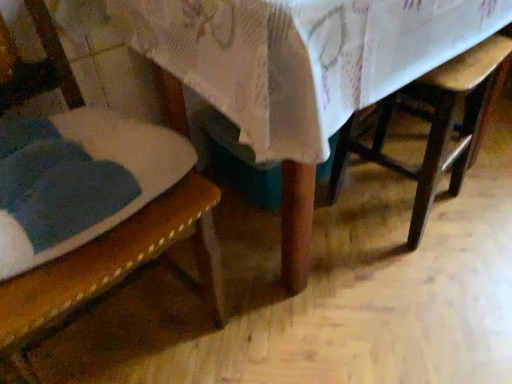
Question: Does wooden chair at lower right have a larger size compared to wooden table at center?

Choices:
 (A) yes
 (B) no

Answer: (B)

Question: Is wooden chair at lower right taller than wooden table at center?

Choices:
 (A) no
 (B) yes

Answer: (A)

Question: Is wooden chair at lower right far from wooden table at center?

Choices:
 (A) yes
 (B) no

Answer: (B)

Question: Can we say wooden chair at lower right lies outside wooden table at center?

Choices:
 (A) no
 (B) yes

Answer: (A)

Question: Is wooden chair at lower right thinner than wooden table at center?

Choices:
 (A) no
 (B) yes

Answer: (B)

Question: Considering the positions of wooden textured chair at left and wooden chair at lower right in the image, is wooden textured chair at left bigger or smaller than wooden chair at lower right?

Choices:
 (A) big
 (B) small

Answer: (A)

Question: Does point (89, 271) appear closer or farther from the camera than point (420, 173)?

Choices:
 (A) farther
 (B) closer

Answer: (B)

Question: Looking at their shapes, would you say wooden textured chair at left is wider or thinner than wooden chair at lower right?

Choices:
 (A) thin
 (B) wide

Answer: (B)

Question: In the image, is wooden textured chair at left positioned in front of or behind wooden chair at lower right?

Choices:
 (A) behind
 (B) front

Answer: (B)

Question: Looking at the image, does wooden textured chair at left seem bigger or smaller compared to wooden table at center?

Choices:
 (A) small
 (B) big

Answer: (A)

Question: Is wooden textured chair at left to the left or to the right of wooden table at center in the image?

Choices:
 (A) right
 (B) left

Answer: (B)

Question: From a real-world perspective, is wooden textured chair at left above or below wooden table at center?

Choices:
 (A) above
 (B) below

Answer: (A)

Question: Relative to wooden table at center, is wooden textured chair at left in front or behind?

Choices:
 (A) front
 (B) behind

Answer: (A)

Question: Is wooden table at center situated inside wooden textured chair at left or outside?

Choices:
 (A) outside
 (B) inside

Answer: (A)

Question: Does point (286, 112) appear closer or farther from the camera than point (74, 276)?

Choices:
 (A) farther
 (B) closer

Answer: (A)